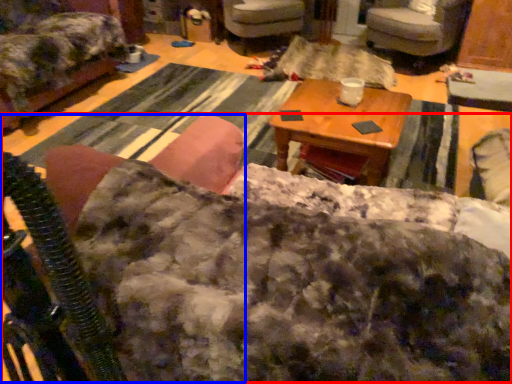
Question: Which object appears closest to the camera in this image, couch (highlighted by a red box) or rocking chair (highlighted by a blue box)?

Choices:
 (A) couch
 (B) rocking chair

Answer: (B)